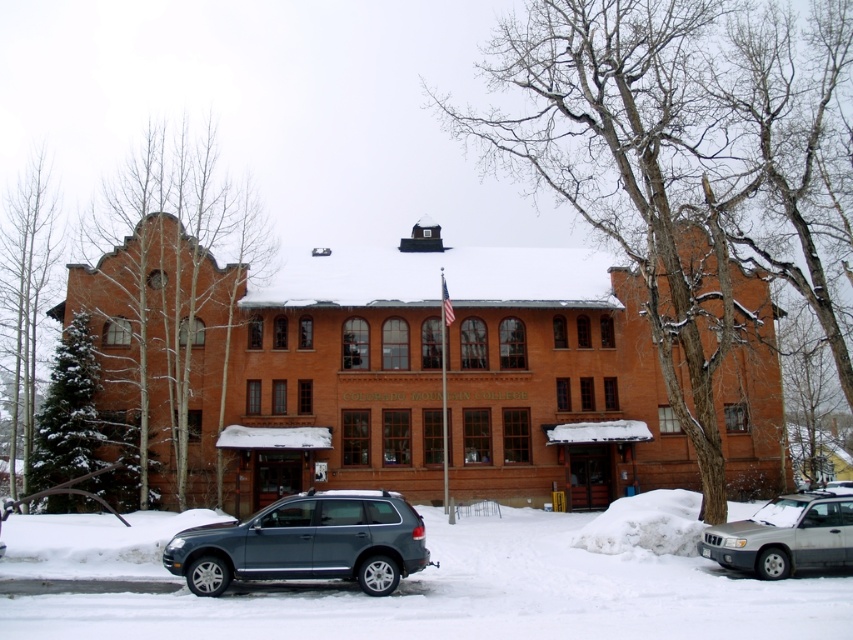
Does metallic gray suv at center appear on the right side of silver metallic suv at lower right?

No, metallic gray suv at center is not to the right of silver metallic suv at lower right.

Is point (236, 545) closer to viewer compared to point (792, 544)?

That is True.

Does point (200, 541) lie behind point (735, 545)?

No, it is in front of (735, 545).

Identify the location of metallic gray suv at center. This screenshot has width=853, height=640. (306, 541).

Does point (473, 634) lie behind point (370, 579)?

No, (473, 634) is in front of (370, 579).

Is point (64, 528) less distant than point (360, 493)?

No, it is not.

At what (x,y) coordinates should I click in order to perform the action: click on white powdery snow at lower center. Please return your answer as a coordinate pair (x, y). This screenshot has height=640, width=853. Looking at the image, I should click on (490, 589).

Locate an element on the screen. white powdery snow at lower center is located at coordinates (490, 589).

Can you confirm if white powdery snow at lower center is positioned to the right of silver metallic suv at lower right?

Incorrect, white powdery snow at lower center is not on the right side of silver metallic suv at lower right.

Does point (144, 554) come in front of point (767, 524)?

No.

At what (x,y) coordinates should I click in order to perform the action: click on white powdery snow at lower center. Please return your answer as a coordinate pair (x, y). Looking at the image, I should click on (490, 589).